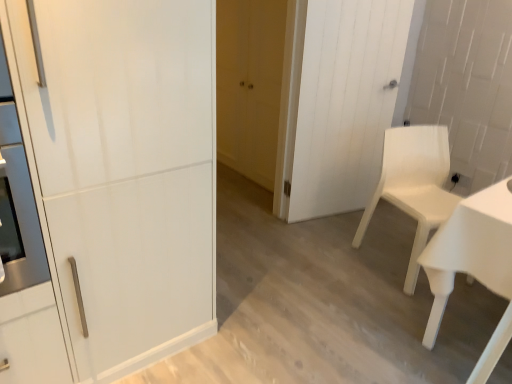
Question: In the image, is white wood door at center, arranged as the second door when viewed from the front, on the left side or the right side of white plastic chair at right?

Choices:
 (A) left
 (B) right

Answer: (A)

Question: Looking at the image, does white wood door at center, the 3th door positioned from the left, seem bigger or smaller compared to white plastic chair at right?

Choices:
 (A) small
 (B) big

Answer: (A)

Question: Which object is the farthest from the white plastic chair at right?

Choices:
 (A) white glossy cabinet at left, which is the first door in front-to-back order
 (B) matte yellow door at center, which appears as the 1th door when viewed from the back
 (C) white wood door at center, arranged as the second door when viewed from the front

Answer: (A)

Question: Which object is the farthest from the white wood door at center, the second door when ordered from back to front?

Choices:
 (A) white glossy cabinet at left, the third door in the right-to-left sequence
 (B) matte yellow door at center, which appears as the 1th door when viewed from the back
 (C) white plastic chair at right

Answer: (A)